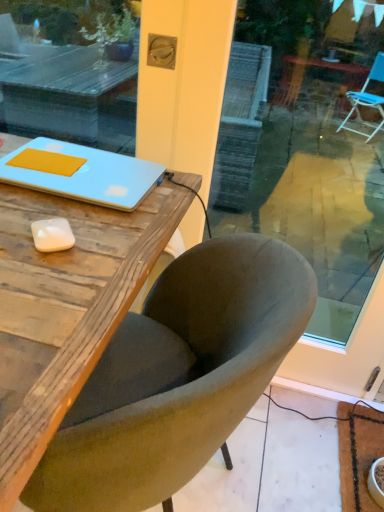
Question: From the image's perspective, is velvet green chair at center above or below matte blue laptop at upper left?

Choices:
 (A) below
 (B) above

Answer: (A)

Question: Looking at their shapes, would you say velvet green chair at center is wider or thinner than matte blue laptop at upper left?

Choices:
 (A) thin
 (B) wide

Answer: (B)

Question: Considering the positions of velvet green chair at center and matte blue laptop at upper left in the image, is velvet green chair at center bigger or smaller than matte blue laptop at upper left?

Choices:
 (A) small
 (B) big

Answer: (B)

Question: From a real-world perspective, is matte blue laptop at upper left positioned above or below velvet green chair at center?

Choices:
 (A) above
 (B) below

Answer: (A)

Question: In the image, is matte blue laptop at upper left positioned in front of or behind velvet green chair at center?

Choices:
 (A) front
 (B) behind

Answer: (B)

Question: Based on their sizes in the image, would you say matte blue laptop at upper left is bigger or smaller than velvet green chair at center?

Choices:
 (A) big
 (B) small

Answer: (B)

Question: Considering the relative positions of matte blue laptop at upper left and velvet green chair at center in the image provided, is matte blue laptop at upper left to the left or to the right of velvet green chair at center?

Choices:
 (A) right
 (B) left

Answer: (B)